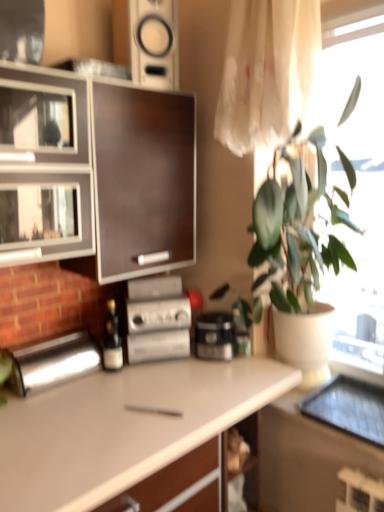
Question: Is wooden shelf at lower center positioned with its back to white matte countertop at center?

Choices:
 (A) no
 (B) yes

Answer: (B)

Question: Could you tell me if wooden shelf at lower center is facing white matte countertop at center?

Choices:
 (A) yes
 (B) no

Answer: (A)

Question: From the image's perspective, is wooden shelf at lower center beneath white matte countertop at center?

Choices:
 (A) yes
 (B) no

Answer: (B)

Question: Would you say wooden shelf at lower center is outside white matte countertop at center?

Choices:
 (A) no
 (B) yes

Answer: (A)

Question: From a real-world perspective, is wooden shelf at lower center positioned under white matte countertop at center based on gravity?

Choices:
 (A) yes
 (B) no

Answer: (B)

Question: Is point (52, 348) positioned closer to the camera than point (221, 450)?

Choices:
 (A) closer
 (B) farther

Answer: (B)

Question: Would you say polished stainless steel bread bin at left, acting as the first appliance starting from the left, is to the left or to the right of wooden shelf at lower center in the picture?

Choices:
 (A) right
 (B) left

Answer: (B)

Question: Is polished stainless steel bread bin at left, acting as the first appliance starting from the left, wider or thinner than wooden shelf at lower center?

Choices:
 (A) thin
 (B) wide

Answer: (B)

Question: From the image's perspective, is polished stainless steel bread bin at left, the 2th appliance positioned from the right, positioned above or below wooden shelf at lower center?

Choices:
 (A) below
 (B) above

Answer: (B)

Question: Is green matte plant at upper right to the left or to the right of polished stainless steel bread bin at left, acting as the first appliance starting from the left, in the image?

Choices:
 (A) left
 (B) right

Answer: (B)

Question: Relative to polished stainless steel bread bin at left, acting as the first appliance starting from the left, is green matte plant at upper right in front or behind?

Choices:
 (A) front
 (B) behind

Answer: (A)

Question: Looking at their shapes, would you say green matte plant at upper right is wider or thinner than polished stainless steel bread bin at left, the 2th appliance positioned from the right?

Choices:
 (A) wide
 (B) thin

Answer: (A)

Question: From the image's perspective, is green matte plant at upper right positioned above or below polished stainless steel bread bin at left, acting as the first appliance starting from the left?

Choices:
 (A) below
 (B) above

Answer: (B)

Question: Is white matte countertop at center inside the boundaries of translucent white curtain at upper right, or outside?

Choices:
 (A) outside
 (B) inside

Answer: (A)

Question: Is point (84, 483) closer or farther from the camera than point (283, 97)?

Choices:
 (A) farther
 (B) closer

Answer: (B)